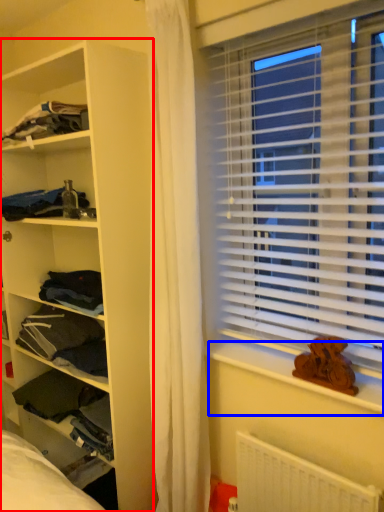
Question: Which of the following is the closest to the observer, shelf (highlighted by a red box) or window sill (highlighted by a blue box)?

Choices:
 (A) shelf
 (B) window sill

Answer: (B)